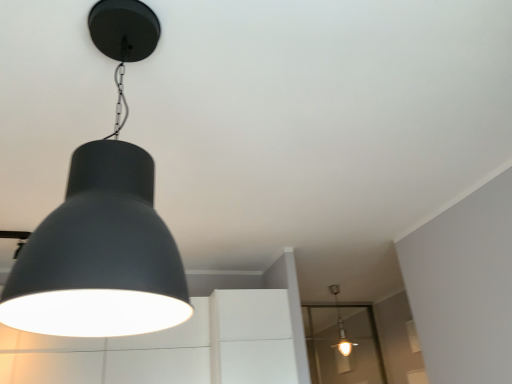
Question: Considering the relative sizes of matte black lampshade at upper left, which is the 2th lamp in right-to-left order, and matte white bulb at center, which is counted as the first lamp, starting from the back, in the image provided, is matte black lampshade at upper left, which is the 2th lamp in right-to-left order, shorter than matte white bulb at center, which is counted as the first lamp, starting from the back,?

Choices:
 (A) yes
 (B) no

Answer: (B)

Question: Can we say matte black lampshade at upper left, the 1th lamp positioned from the top, lies outside matte white bulb at center, the second lamp from the top?

Choices:
 (A) yes
 (B) no

Answer: (A)

Question: Is matte black lampshade at upper left, the second lamp ordered from the bottom, not close to matte white bulb at center, the 2th lamp when ordered from left to right?

Choices:
 (A) yes
 (B) no

Answer: (A)

Question: Can you confirm if matte black lampshade at upper left, the 1th lamp positioned from the top, is thinner than matte white bulb at center, which is counted as the first lamp, starting from the bottom?

Choices:
 (A) no
 (B) yes

Answer: (A)

Question: Does matte black lampshade at upper left, the second lamp ordered from the bottom, appear on the left side of matte white bulb at center, placed as the first lamp when sorted from right to left?

Choices:
 (A) no
 (B) yes

Answer: (B)

Question: Is matte black lampshade at upper left, positioned as the first lamp in front-to-back order, oriented towards matte white bulb at center, the 2th lamp when ordered from left to right?

Choices:
 (A) no
 (B) yes

Answer: (A)

Question: Can you confirm if transparent glass door at lower right is positioned to the left of matte white bulb at center, the 2th lamp in the front-to-back sequence?

Choices:
 (A) yes
 (B) no

Answer: (B)

Question: Is transparent glass door at lower right smaller than matte white bulb at center, the second lamp from the top?

Choices:
 (A) yes
 (B) no

Answer: (B)

Question: Is transparent glass door at lower right aimed at matte white bulb at center, placed as the first lamp when sorted from right to left?

Choices:
 (A) yes
 (B) no

Answer: (A)

Question: Does transparent glass door at lower right contain matte white bulb at center, the 2th lamp when ordered from left to right?

Choices:
 (A) no
 (B) yes

Answer: (A)

Question: Can you confirm if transparent glass door at lower right is wider than matte white bulb at center, the second lamp from the top?

Choices:
 (A) yes
 (B) no

Answer: (B)

Question: Is transparent glass door at lower right shorter than matte white bulb at center, which is counted as the first lamp, starting from the back?

Choices:
 (A) no
 (B) yes

Answer: (A)

Question: From a real-world perspective, does matte white bulb at center, the second lamp from the top, sit lower than matte black lampshade at upper left, positioned as the 2th lamp in back-to-front order?

Choices:
 (A) no
 (B) yes

Answer: (A)